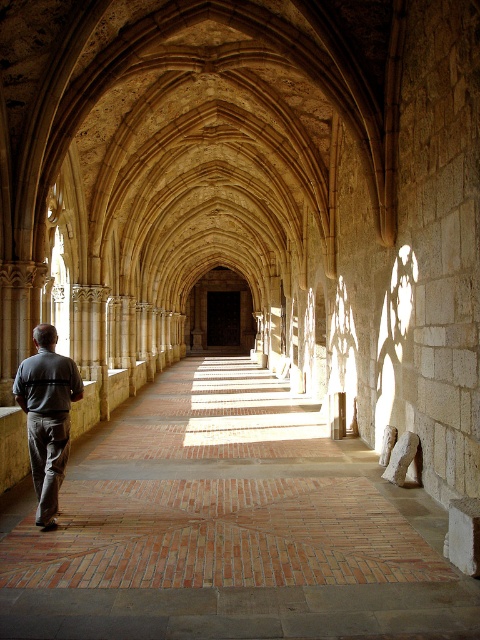
You are standing at the entrance of the corridor and notice a brick at center. Can you determine its exact position using the coordinate system provided?

The brick at center is located at point coordinates (228, 525).

You are standing at the entrance of the corridor in the historic building. You notice a brick at center located at point (228, 525). If you walk straight ahead, will you reach the brick before the corridor ends?

The brick at center located at point (228, 525) is positioned along the corridor. Since the corridor extends into the distance with its rhythmic pattern of arches, walking straight ahead would lead you towards the brick before the corridor ends.